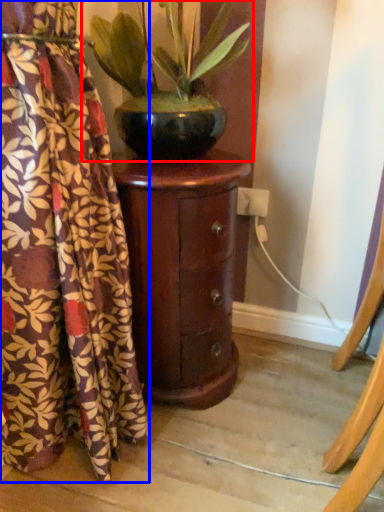
Question: Which object is further to the camera taking this photo, houseplant (highlighted by a red box) or curtain (highlighted by a blue box)?

Choices:
 (A) houseplant
 (B) curtain

Answer: (A)